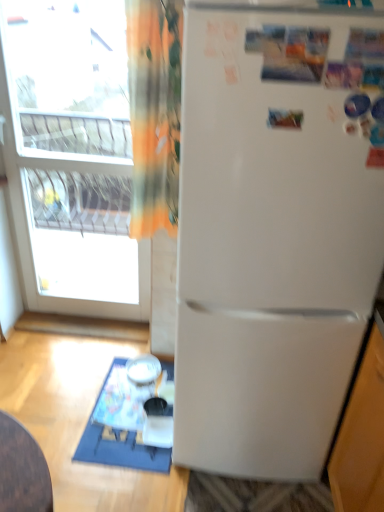
The height and width of the screenshot is (512, 384). I want to click on free space to the left of white glossy bowl at lower center, so click(114, 367).